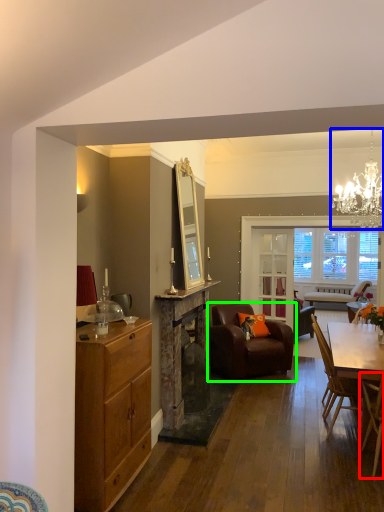
Question: Based on their relative distances, which object is nearer to chair (highlighted by a red box)? Choose from light fixture (highlighted by a blue box) and chair (highlighted by a green box).

Choices:
 (A) light fixture
 (B) chair

Answer: (B)